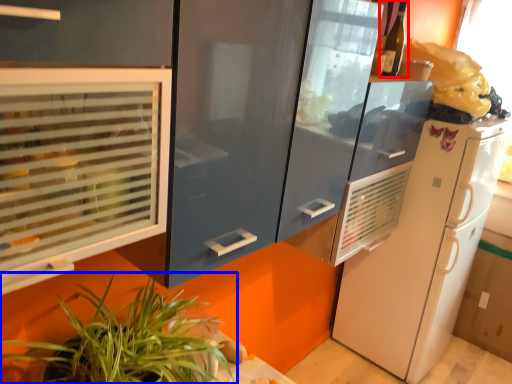
Question: Which object appears closest to the camera in this image, wine bottle (highlighted by a red box) or houseplant (highlighted by a blue box)?

Choices:
 (A) wine bottle
 (B) houseplant

Answer: (B)